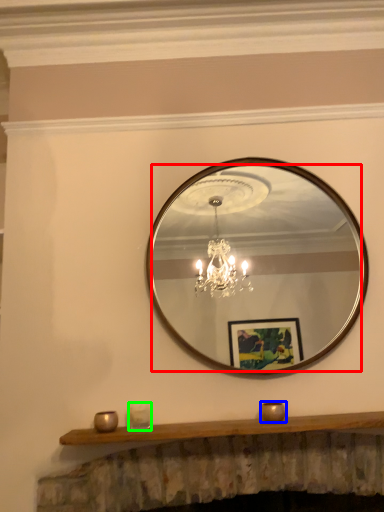
Question: Which is nearer to the mirror (highlighted by a red box)? candle holder (highlighted by a blue box) or candle holder (highlighted by a green box).

Choices:
 (A) candle holder
 (B) candle holder

Answer: (A)